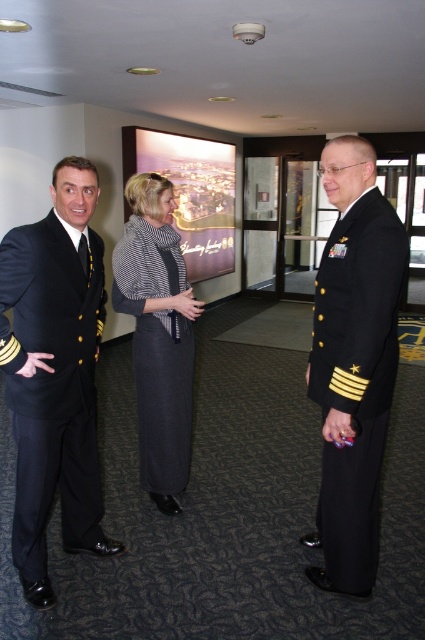
Does point (53, 593) lie behind point (348, 512)?

Yes, it is behind point (348, 512).

Does point (14, 417) come closer to viewer compared to point (317, 372)?

Yes, it is in front of point (317, 372).

Between point (10, 362) and point (334, 504), which one is positioned in front?

Point (10, 362) is in front.

The width and height of the screenshot is (425, 640). Identify the location of shiny black suit at left. (54, 372).

Between black wool suit at center and shiny black suit at left, which one is positioned higher?

black wool suit at center is higher up.

From the picture: Does black wool suit at center have a lesser width compared to shiny black suit at left?

Yes.

Who is more distant from viewer, (399, 273) or (14, 356)?

The point (14, 356) is more distant.

Identify the location of black wool suit at center. (354, 362).

Is point (339, 220) positioned before point (153, 324)?

Yes, it is in front of point (153, 324).

Who is more forward, (340, 220) or (155, 209)?

Point (340, 220) is more forward.

Which is in front, point (323, 388) or point (184, 352)?

Point (323, 388)

The width and height of the screenshot is (425, 640). Identify the location of shiny black uniform at center. (354, 362).